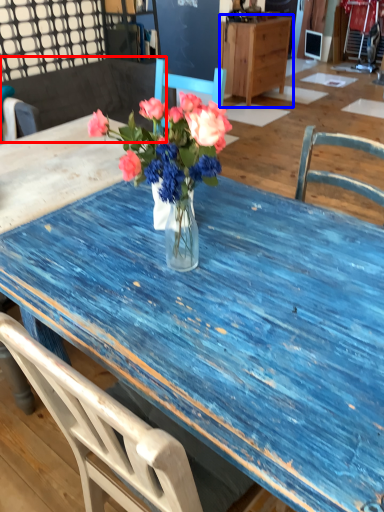
Question: Among these objects, which one is farthest to the camera, chair (highlighted by a red box) or cabinetry (highlighted by a blue box)?

Choices:
 (A) chair
 (B) cabinetry

Answer: (B)